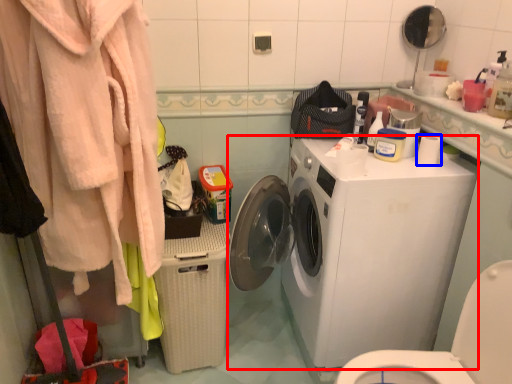
Question: Which object is further to the camera taking this photo, washing machine (highlighted by a red box) or toilet paper (highlighted by a blue box)?

Choices:
 (A) washing machine
 (B) toilet paper

Answer: (B)